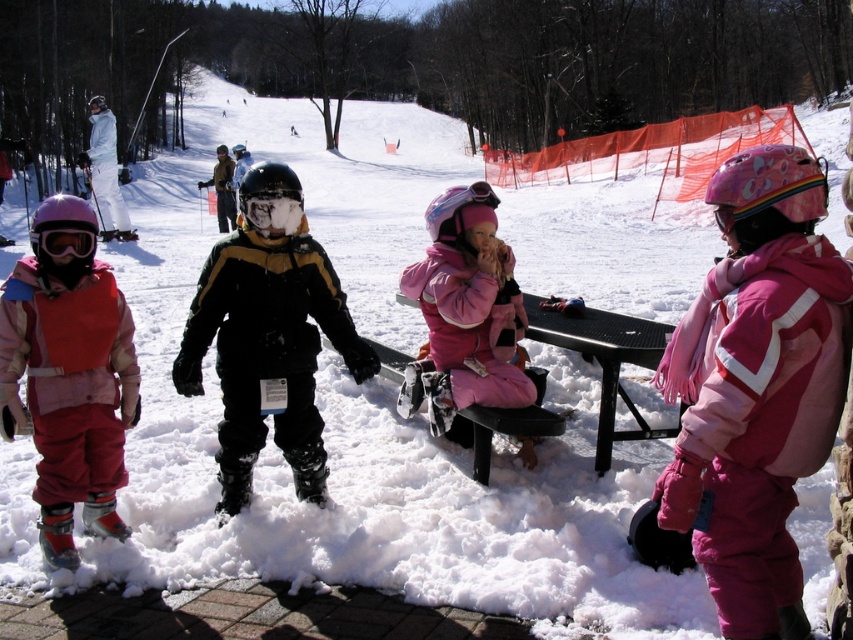
Question: Does matte pink snowsuit at left have a lesser width compared to black metal picnic table at center?

Choices:
 (A) yes
 (B) no

Answer: (A)

Question: Which object is closer to the camera taking this photo?

Choices:
 (A) pink matte snowsuit at center
 (B) white snowsuit at upper left
 (C) black matte snowboard at center

Answer: (C)

Question: Does matte pink snowsuit at left appear under black metal picnic table at center?

Choices:
 (A) no
 (B) yes

Answer: (A)

Question: Does black matte snowboard at center have a larger size compared to white snowsuit at upper left?

Choices:
 (A) yes
 (B) no

Answer: (B)

Question: Which point is farther to the camera?

Choices:
 (A) (524, 444)
 (B) (103, 157)
 (C) (86, 237)

Answer: (B)

Question: Which object is farther from the camera taking this photo?

Choices:
 (A) pink matte snowsuit at center
 (B) black matte snowboard at center
 (C) matte black goggles at left

Answer: (A)